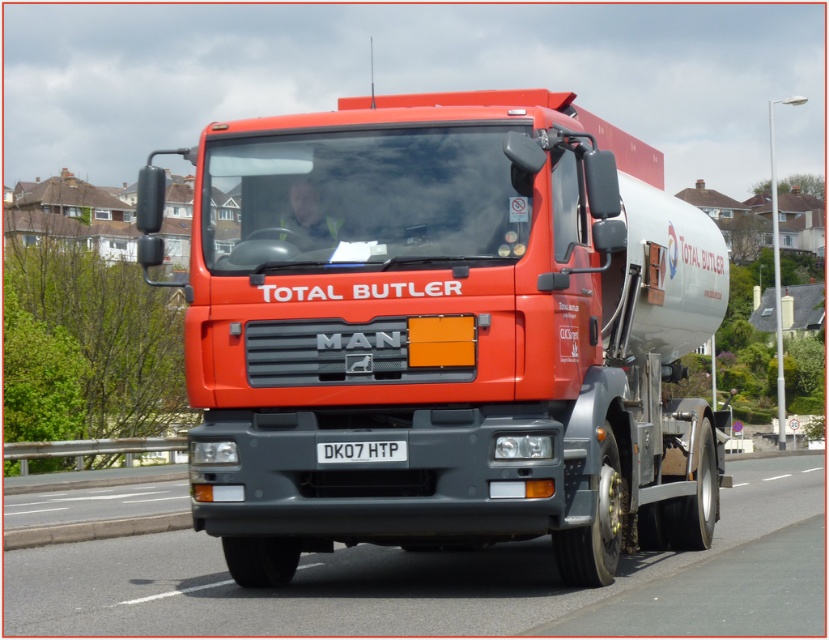
You are a delivery driver who needs to exit the highway. You see the metallic red trailer truck at center and the black rubber highway at center. Which object is closer to you as you look forward?

The metallic red trailer truck at center is closer to you because the black rubber highway at center is behind it.

You are a photographer standing at the edge of a construction site. You want to take a photo of the metallic red trailer truck at center and the black rubber highway at center. Based on their positions, which object should you adjust your camera to focus on first if you want to capture both in the frame?

The metallic red trailer truck at center is to the left of black rubber highway at center. Since the truck is positioned to the left, you should focus on the metallic red trailer truck at center first to ensure it stays within the frame while adjusting for the highway.